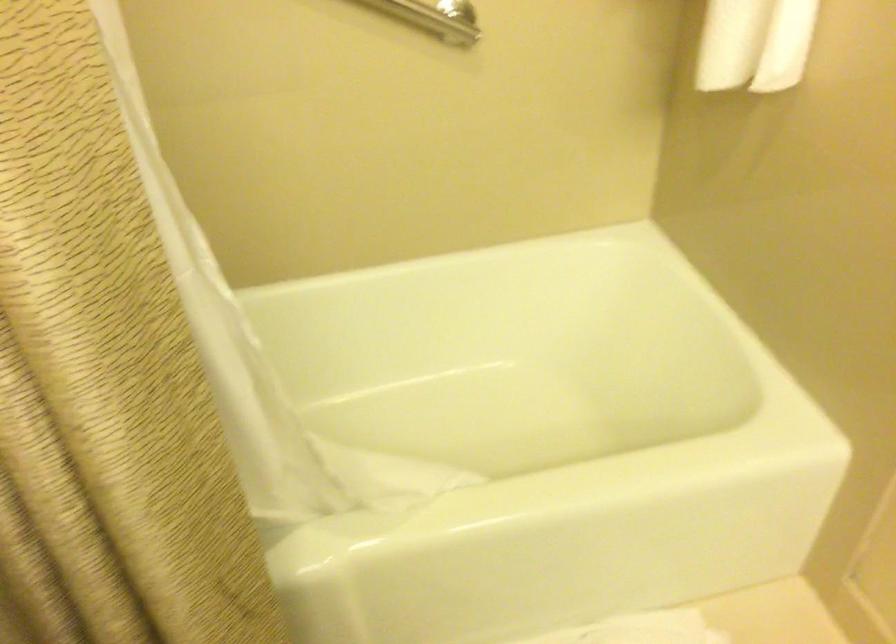
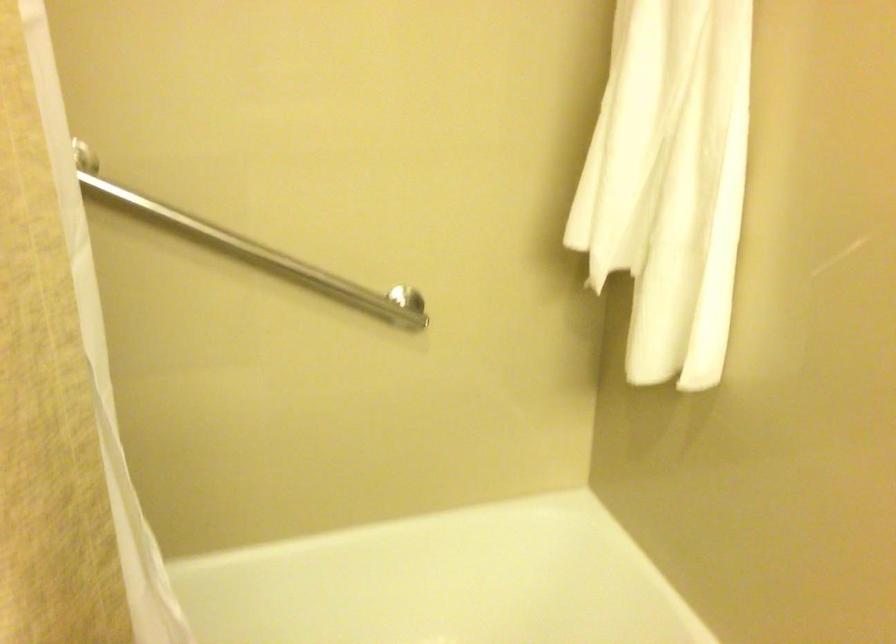
Question: The first image is from the beginning of the video and the second image is from the end. How did the camera likely rotate when shooting the video?

Choices:
 (A) Left
 (B) Right
 (C) Up
 (D) Down

Answer: (C)